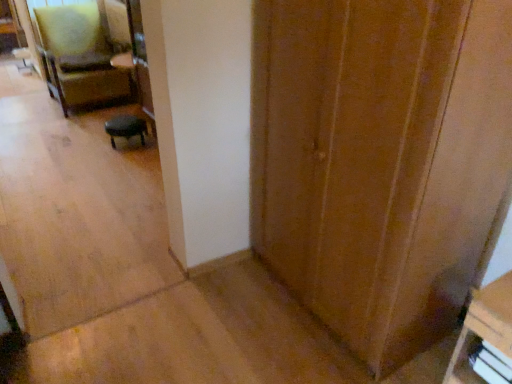
Question: Visually, is wooden bookshelf at lower right, the 1th furniture from the right, positioned to the left or to the right of wooden door at center?

Choices:
 (A) left
 (B) right

Answer: (B)

Question: Is wooden bookshelf at lower right, arranged as the first furniture when viewed from the front, bigger or smaller than wooden door at center?

Choices:
 (A) big
 (B) small

Answer: (B)

Question: Based on their relative distances, which object is nearer to the black leather stool at center, which is counted as the second furniture, starting from the right?

Choices:
 (A) white plastic drawer at lower right
 (B) wooden door at center
 (C) velvet green armchair at upper left
 (D) wooden bookshelf at lower right, acting as the 2th furniture starting from the left

Answer: (C)

Question: Based on their relative distances, which object is nearer to the black leather stool at center, which is the 1th furniture in back-to-front order?

Choices:
 (A) white plastic drawer at lower right
 (B) wooden bookshelf at lower right, the second furniture viewed from the back
 (C) velvet green armchair at upper left
 (D) wooden door at center

Answer: (C)